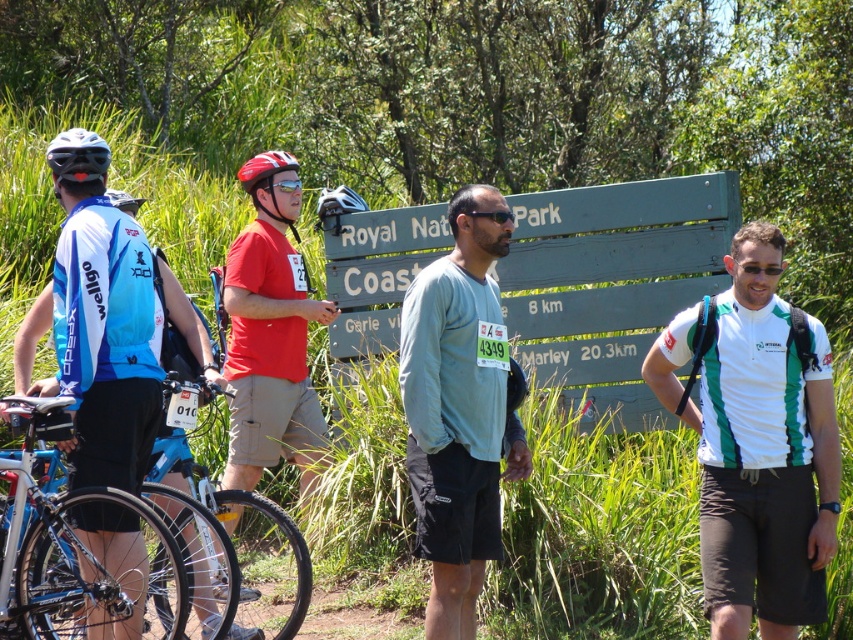
You are a photographer trying to capture a clear shot of the shiny red helmet at center and the black matte sunglasses at center. Which object should you focus on first if you want to ensure both are in focus?

The shiny red helmet at center is above the black matte sunglasses at center, so focusing on the helmet first will help ensure both are in focus since they are at different vertical levels.